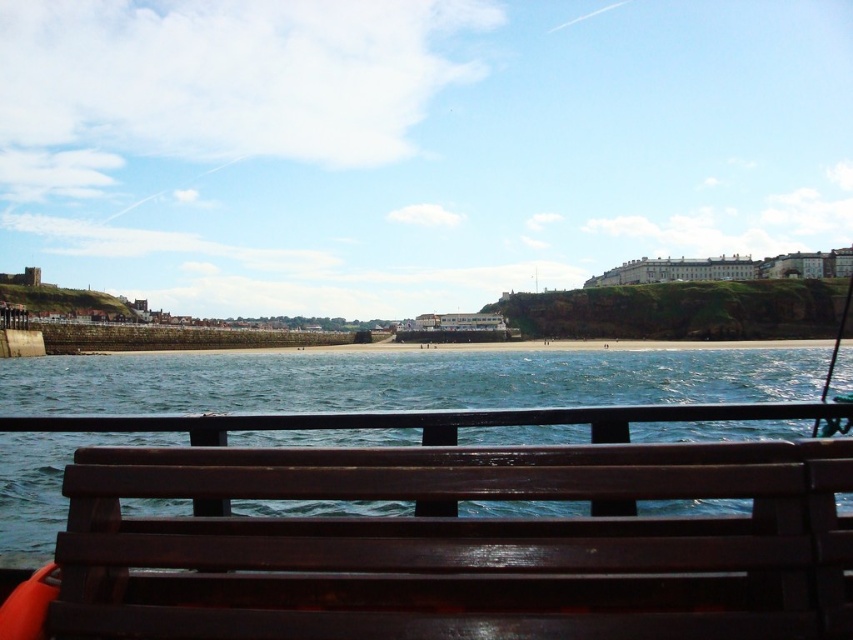
You are standing on the wooden bench and want to grab the fishing pole. Which direction should you move to reach the metallic fishing pole at right from the dark wood bench at lower center?

The dark wood bench at lower center is to the left of the metallic fishing pole at right, so you should move to your right to reach it.

In the scene shown: You are standing on the beach and want to place your metallic fishing pole at right on the dark wood bench at lower center. Is the bench high enough to support the fishing pole?

The dark wood bench at lower center is below metallic fishing pole at right, which means the bench is lower than the fishing pole. Therefore, the bench may not be high enough to securely support the fishing pole.